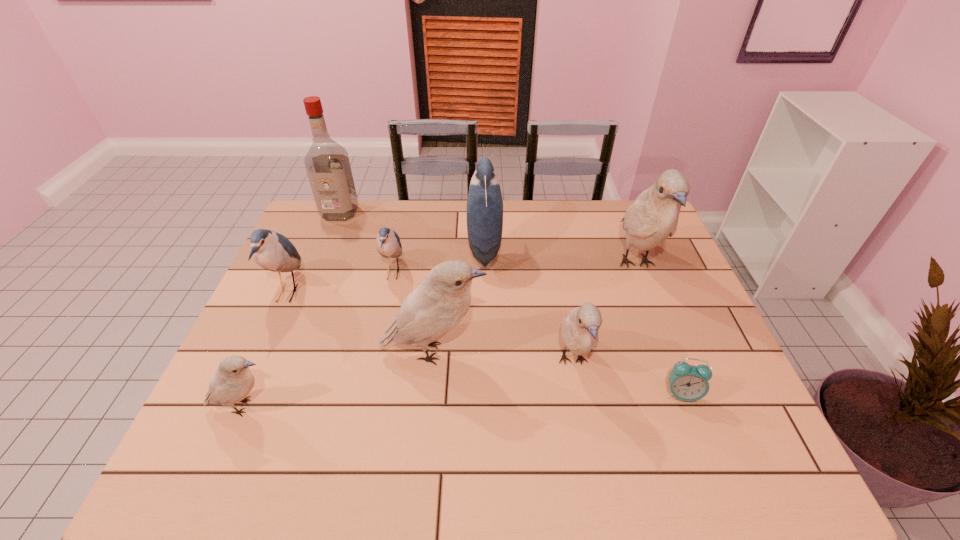
You are a GUI agent. You are given a task and a screenshot of the screen. Output one action in this format:
    pyautogui.click(x=<x>, y=<y>)
    Task: Click on the free location located 0.360m at the beak of the smallest white bird
    Image resolution: width=960 pixels, height=540 pixels.
    Given the screenshot: What is the action you would take?
    pyautogui.click(x=437, y=407)

Find the location of `free point located 0.150m on the face of the alarm clock`. free point located 0.150m on the face of the alarm clock is located at coordinates (710, 471).

Identify the location of liquor that is positioned at the far edge. Image resolution: width=960 pixels, height=540 pixels. (327, 164).

Locate an element on the screen. The height and width of the screenshot is (540, 960). liquor that is at the left edge is located at coordinates (327, 164).

The image size is (960, 540). Identify the location of bird that is at the right edge. pyautogui.click(x=653, y=217).

The image size is (960, 540). I want to click on alarm clock that is at the right edge, so click(687, 382).

This screenshot has width=960, height=540. Find the location of `object located at the far left corner`. object located at the far left corner is located at coordinates (327, 164).

In order to click on object located at the far right corner in this screenshot , I will do `click(653, 217)`.

I want to click on free region at the far edge of the desktop, so click(458, 209).

This screenshot has width=960, height=540. I want to click on vacant space at the near edge of the desktop, so click(x=402, y=447).